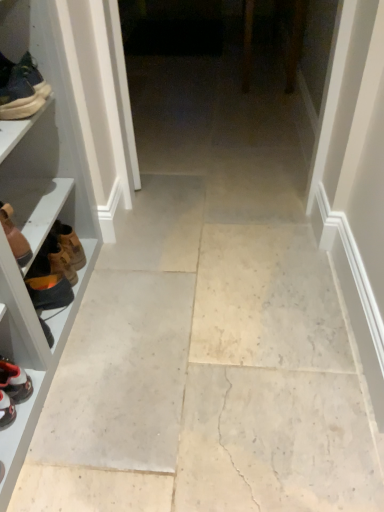
Question: From a real-world perspective, is matte black sneaker at left, which is counted as the 1th footwear, starting from the top, above or below orange suede boot at left, the third footwear from the top?

Choices:
 (A) below
 (B) above

Answer: (B)

Question: From their relative heights in the image, would you say matte black sneaker at left, which is counted as the 1th footwear, starting from the top, is taller or shorter than orange suede boot at left, the third footwear from the top?

Choices:
 (A) short
 (B) tall

Answer: (B)

Question: Which of these objects is positioned farthest from the white leather sneaker at lower left, positioned as the 1th footwear in bottom-to-top order?

Choices:
 (A) orange suede boot at left, the third footwear from the top
 (B) matte black sneaker at left, which is counted as the 1th footwear, starting from the top
 (C) brown leather boot at left, the second footwear from the top
 (D) brown leather shoe at left

Answer: (B)

Question: Based on their relative distances, which object is nearer to the orange suede boot at left, the third footwear from the top?

Choices:
 (A) white leather sneaker at lower left, which ranks as the 4th footwear in top-to-bottom order
 (B) matte black sneaker at left, which is counted as the 1th footwear, starting from the top
 (C) brown leather shoe at left
 (D) brown leather boot at left, the 3th footwear ordered from the bottom

Answer: (C)